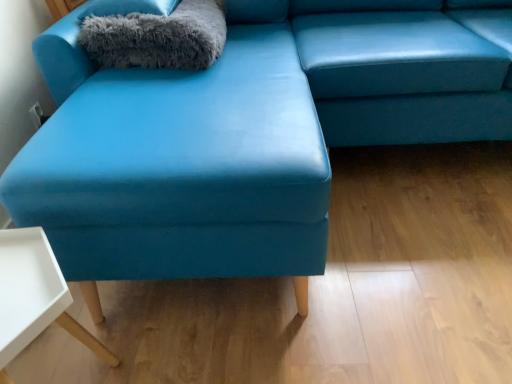
Question: Considering the relative positions of gray fluffy blanket at upper left and gray fluffy pillow at upper left in the image provided, is gray fluffy blanket at upper left to the left or to the right of gray fluffy pillow at upper left?

Choices:
 (A) left
 (B) right

Answer: (B)

Question: Is gray fluffy blanket at upper left bigger or smaller than gray fluffy pillow at upper left?

Choices:
 (A) small
 (B) big

Answer: (B)

Question: Considering the real-world distances, which object is farthest from the gray fluffy blanket at upper left?

Choices:
 (A) matte blue cushion at center
 (B) white matte table at lower left
 (C) gray fluffy pillow at upper left

Answer: (B)

Question: Estimate the real-world distances between objects in this image. Which object is farther from the gray fluffy blanket at upper left?

Choices:
 (A) gray fluffy pillow at upper left
 (B) white matte table at lower left
 (C) matte blue cushion at center

Answer: (B)